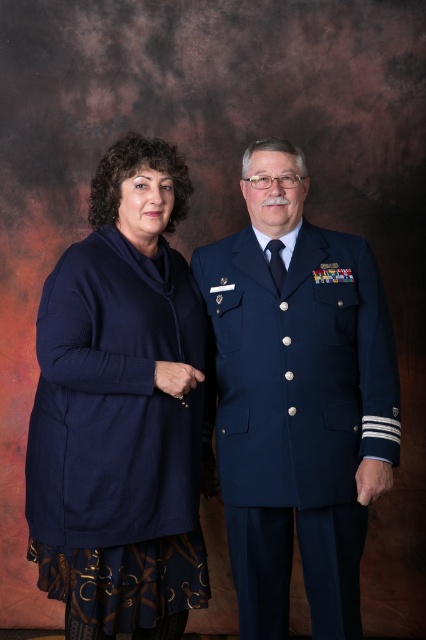
Question: Does navy knit sweater at left have a lesser width compared to navy blue uniform at center?

Choices:
 (A) no
 (B) yes

Answer: (B)

Question: Is navy knit sweater at left smaller than navy blue uniform at center?

Choices:
 (A) yes
 (B) no

Answer: (B)

Question: Considering the relative positions of navy knit sweater at left and navy blue uniform at center in the image provided, where is navy knit sweater at left located with respect to navy blue uniform at center?

Choices:
 (A) right
 (B) left

Answer: (B)

Question: Which of the following is the farthest from the observer?

Choices:
 (A) navy blue uniform at center
 (B) navy knit sweater at left

Answer: (A)

Question: Which object is closer to the camera taking this photo?

Choices:
 (A) navy blue uniform at center
 (B) navy knit sweater at left

Answer: (B)